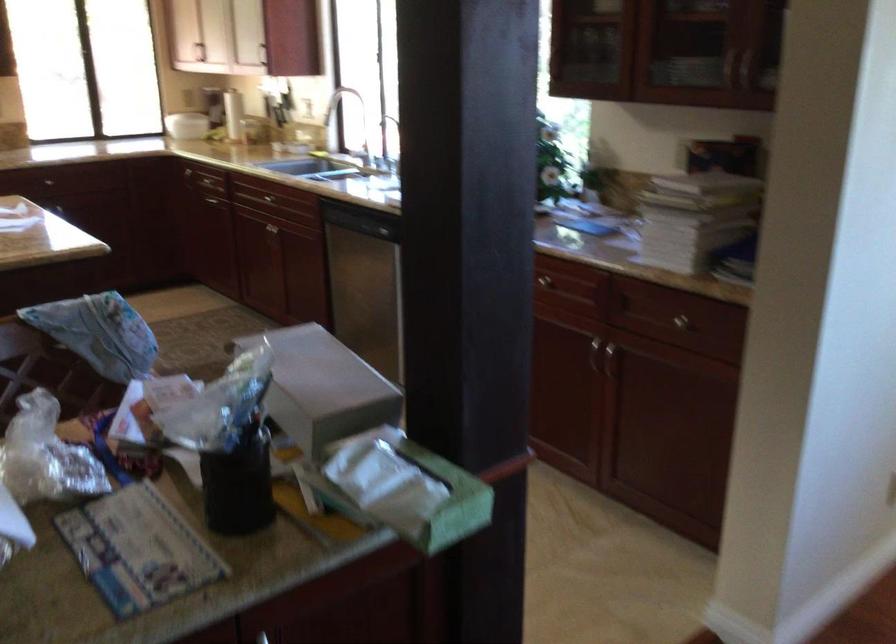
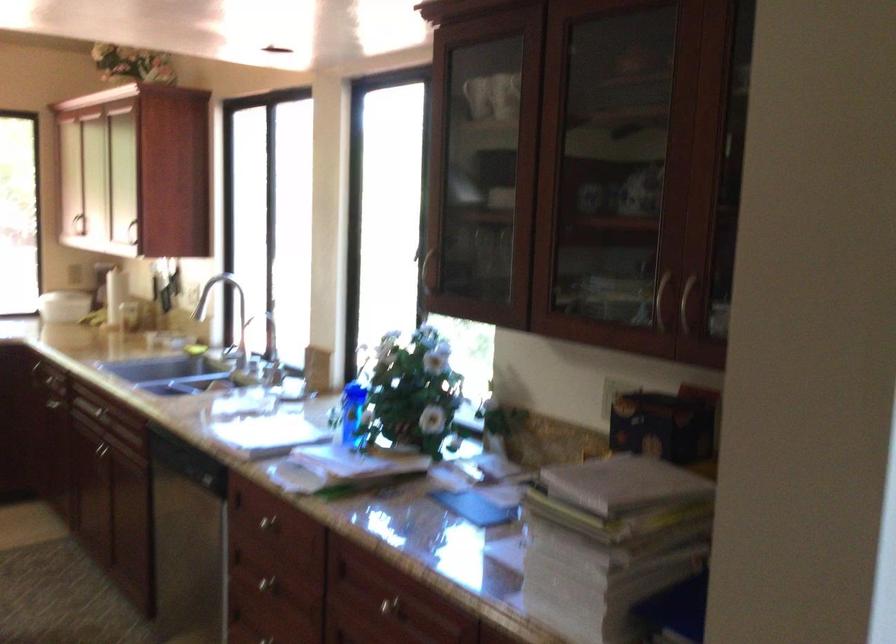
Where in the second image is the point corresponding to point (686, 146) from the first image?

(614, 393)